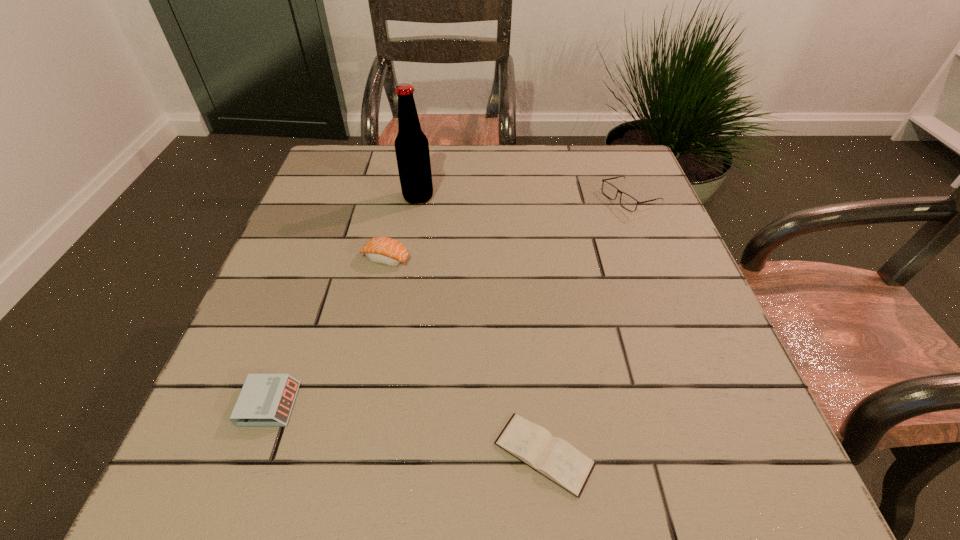
Image resolution: width=960 pixels, height=540 pixels. Find the location of `vacant region that satisfies the following two spatial constraints: 1. on the back side of the beer bottle; 2. on the left side of the second shortest object`. vacant region that satisfies the following two spatial constraints: 1. on the back side of the beer bottle; 2. on the left side of the second shortest object is located at coordinates (344, 197).

Locate an element on the screen. blank area in the image that satisfies the following two spatial constraints: 1. on the front side of the sushi; 2. on the left side of the diary is located at coordinates (344, 454).